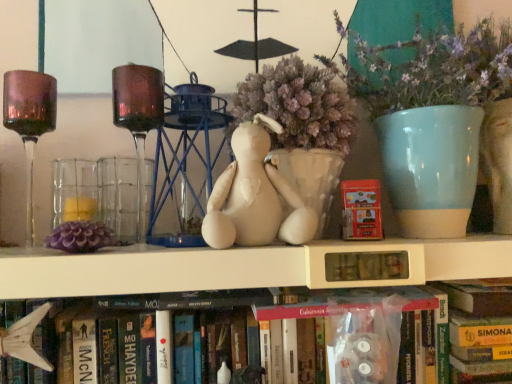
Question: Can you confirm if matte ceramic vase at upper right is thinner than translucent glass candle holder at left?

Choices:
 (A) no
 (B) yes

Answer: (A)

Question: Can you confirm if matte ceramic vase at upper right is positioned to the left of translucent glass candle holder at left?

Choices:
 (A) no
 (B) yes

Answer: (A)

Question: Does matte ceramic vase at upper right have a smaller size compared to translucent glass candle holder at left?

Choices:
 (A) no
 (B) yes

Answer: (A)

Question: From the image's perspective, does matte ceramic vase at upper right appear higher than translucent glass candle holder at left?

Choices:
 (A) no
 (B) yes

Answer: (B)

Question: Is matte ceramic vase at upper right oriented away from translucent glass candle holder at left?

Choices:
 (A) yes
 (B) no

Answer: (B)

Question: Can you confirm if matte ceramic vase at upper right is taller than translucent glass candle holder at left?

Choices:
 (A) yes
 (B) no

Answer: (A)

Question: Does hardcover book at lower center, the first book in the right-to-left sequence, have a greater width compared to hardcover book at center, marked as the 2th book in a right-to-left arrangement?

Choices:
 (A) yes
 (B) no

Answer: (A)

Question: Is hardcover book at lower center, the 2th book from the left, outside of hardcover book at center, the 1th book positioned from the left?

Choices:
 (A) yes
 (B) no

Answer: (A)

Question: Is the surface of hardcover book at lower center, the first book in the right-to-left sequence, in direct contact with hardcover book at center, the 1th book positioned from the left?

Choices:
 (A) yes
 (B) no

Answer: (B)

Question: Is hardcover book at lower center, the 2th book from the left, shorter than hardcover book at center, the 1th book positioned from the left?

Choices:
 (A) no
 (B) yes

Answer: (A)

Question: Is hardcover book at lower center, the first book in the right-to-left sequence, far away from hardcover book at center, marked as the 2th book in a right-to-left arrangement?

Choices:
 (A) no
 (B) yes

Answer: (A)

Question: Is hardcover book at lower center, the first book in the right-to-left sequence, bigger than hardcover book at center, marked as the 2th book in a right-to-left arrangement?

Choices:
 (A) no
 (B) yes

Answer: (A)

Question: From a real-world perspective, is white fabric stuffed animal at center positioned under matte red paperback book at center based on gravity?

Choices:
 (A) no
 (B) yes

Answer: (A)